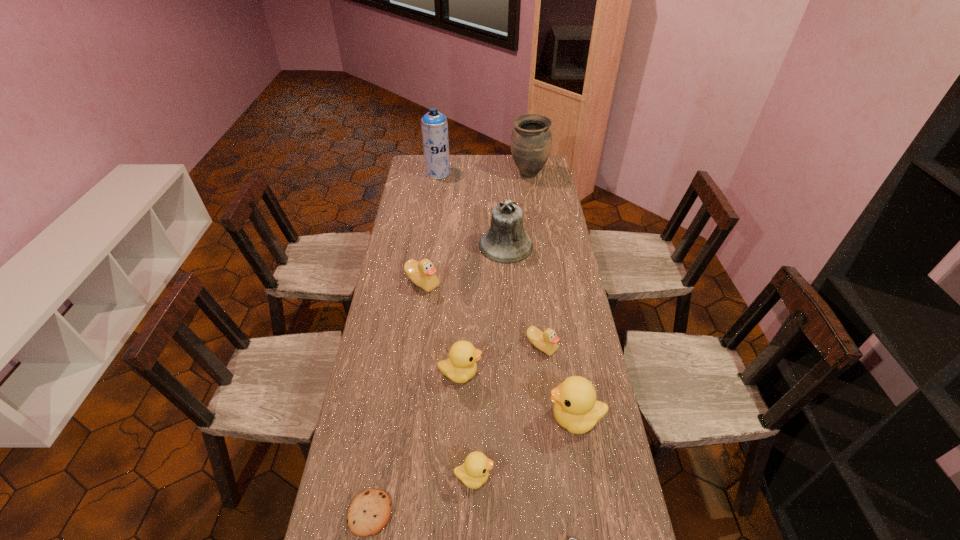
You are a GUI agent. You are given a task and a screenshot of the screen. Output one action in this format:
    pyautogui.click(x=<x>, y=<y>)
    Task: Click on the aerosol can
    The image size is (960, 540).
    Given the screenshot: What is the action you would take?
    pyautogui.click(x=434, y=125)

This screenshot has width=960, height=540. I want to click on blue aerosol can, so (x=434, y=125).

The image size is (960, 540). In order to click on urn in this screenshot , I will do `click(531, 140)`.

The image size is (960, 540). Identify the location of the eighth nearest object. (506, 242).

This screenshot has width=960, height=540. Find the location of `the eighth shortest object`. the eighth shortest object is located at coordinates (506, 242).

Locate an element on the screen. The height and width of the screenshot is (540, 960). the biggest yellow duck is located at coordinates (576, 409).

At what (x,y) coordinates should I click in order to perform the action: click on the tallest duck. Please return your answer as a coordinate pair (x, y). The image size is (960, 540). Looking at the image, I should click on (576, 409).

I want to click on the third nearest duck, so click(461, 366).

Locate an element on the screen. The image size is (960, 540). the second smallest yellow duck is located at coordinates (461, 366).

At what (x,y) coordinates should I click in order to perform the action: click on the left beige duck. Please return your answer as a coordinate pair (x, y). Looking at the image, I should click on (422, 273).